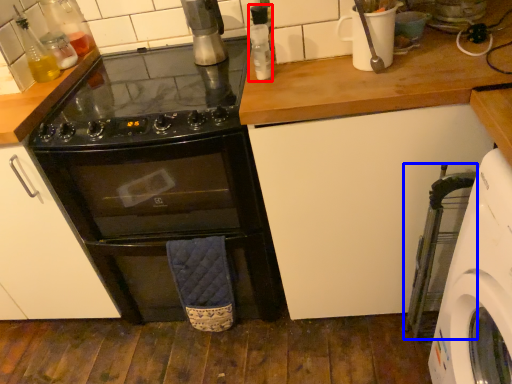
Question: Which of the following is the closest to the observer, bottle (highlighted by a red box) or appliance (highlighted by a blue box)?

Choices:
 (A) bottle
 (B) appliance

Answer: (B)